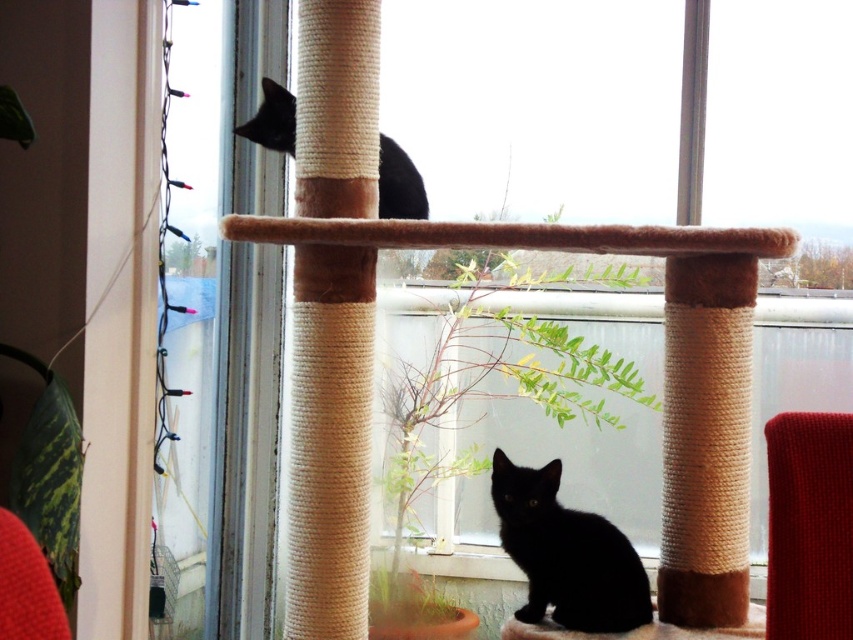
You are a cat owner who wants to ensure your cats can safely climb between the matte black cat at lower center and the black matte cat at upper left. Given that the cats can jump up to 24 inches vertically, is there enough space for them to reach each other?

The distance between the matte black cat at lower center and the black matte cat at upper left is 22.79 inches. Since the cats can jump up to 24 inches vertically, they can safely reach each other as the required distance is within their jumping capability.

You are a cat owner who wants to ensure your cats have enough vertical space on their cat tree. Given the positions of the matte black cat at lower center and the black matte cat at upper left, which cat is positioned higher on the cat tree?

The black matte cat at upper left is positioned higher on the cat tree than the matte black cat at lower center.